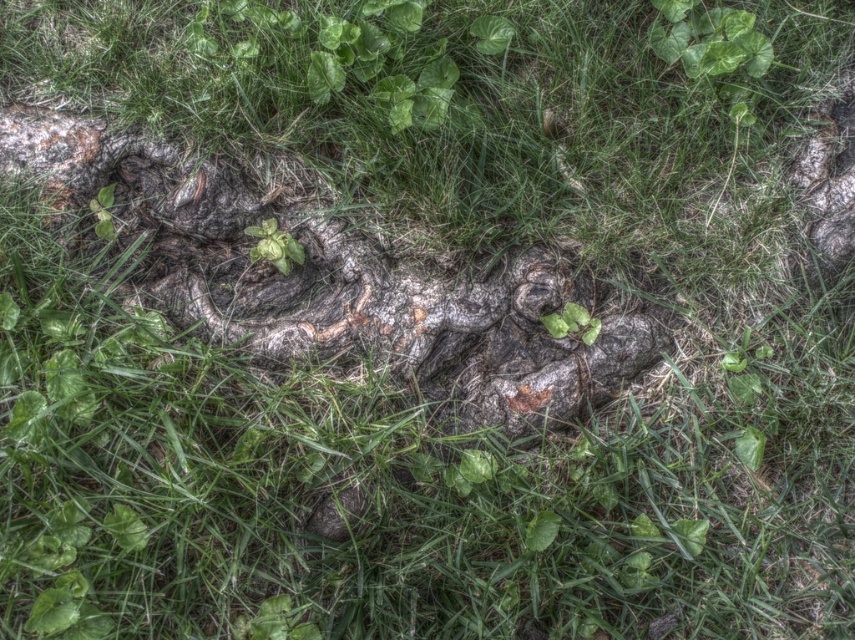
You are a botanist examining the scene and want to identify the relative positions of the green matte leaf at upper center and the green matte plant at center. Which object is located to the right of the other?

The green matte leaf at upper center is positioned on the right side of green matte plant at center.

You are standing in the natural scene described. You see a point marked at coordinates (708, 38). What object is located at that point?

The point at coordinates (708, 38) marks a green matte leaf at upper center.

You are an ecologist studying plant growth in this natural setting. You observe the green matte leaf at upper center and the green matte plant at center. Which of these two has a wider width?

The green matte leaf at upper center might be wider than the green matte plant at center according to the description.